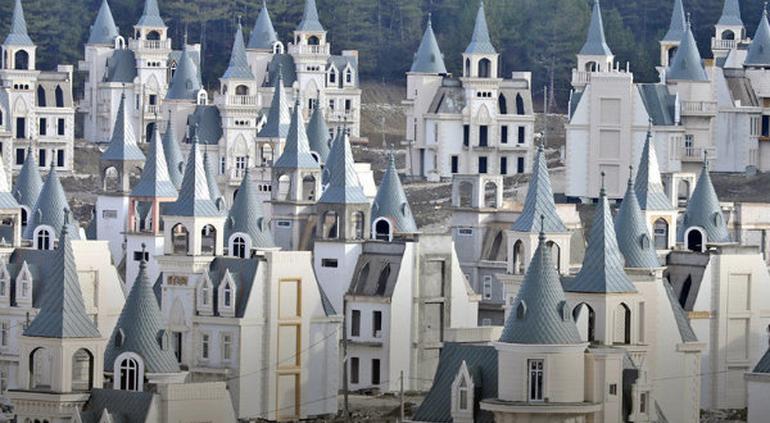
You are a GUI agent. You are given a task and a screenshot of the screen. Output one action in this format:
    pyautogui.click(x=<x>, y=<y>)
    Task: Click on the golden door frame
    The width and height of the screenshot is (770, 423).
    Given the screenshot: What is the action you would take?
    pyautogui.click(x=296, y=303), pyautogui.click(x=296, y=345), pyautogui.click(x=295, y=381)